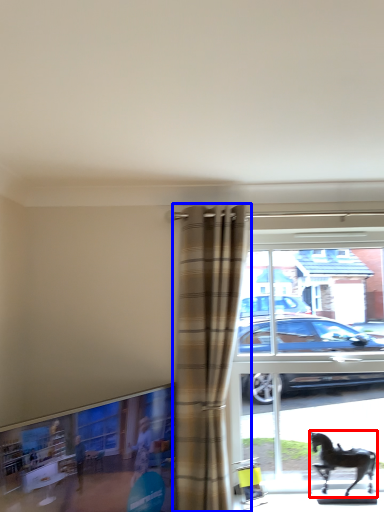
Question: Which object is further to the camera taking this photo, horse (highlighted by a red box) or curtain (highlighted by a blue box)?

Choices:
 (A) horse
 (B) curtain

Answer: (A)